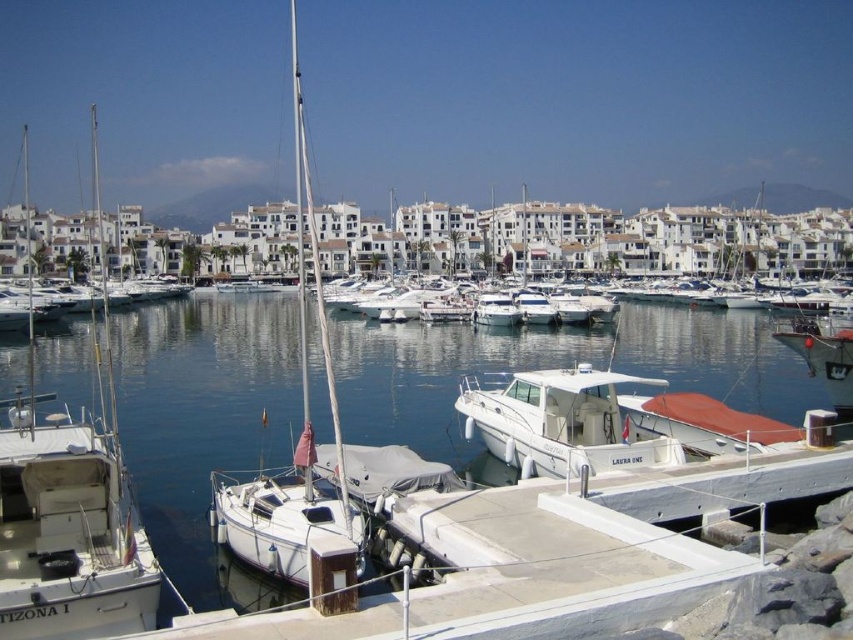
You are standing on the pier and want to board the white glossy motorboat at center and the white matte sailboat at center. Which boat will you reach first if you walk straight ahead?

You will reach the white glossy motorboat at center first because it is closer to you than the white matte sailboat at center.

You are a photographer planning to capture the white glossy motorboat at center and the clear blue water at center in a single shot. Based on their positions, which one would appear closer to the camera in the photo?

The white glossy motorboat at center appears closer to the camera because the clear blue water at center is positioned behind it.

You are standing at the edge of the marina and see two points marked in the scene. Which point is closer to you, point (532, 387) or point (357, 554)?

Point (357, 554) is closer to you because it is less further to the camera than point (532, 387).